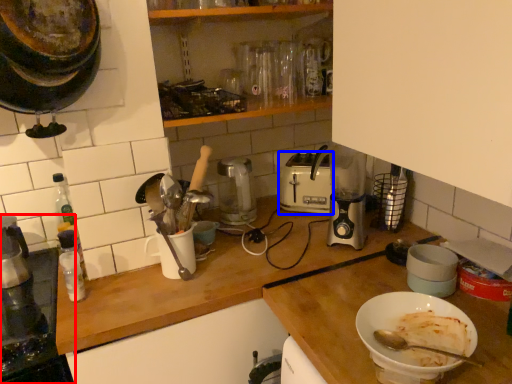
Question: Which object appears closest to the camera in this image, home appliance (highlighted by a red box) or toaster (highlighted by a blue box)?

Choices:
 (A) home appliance
 (B) toaster

Answer: (A)